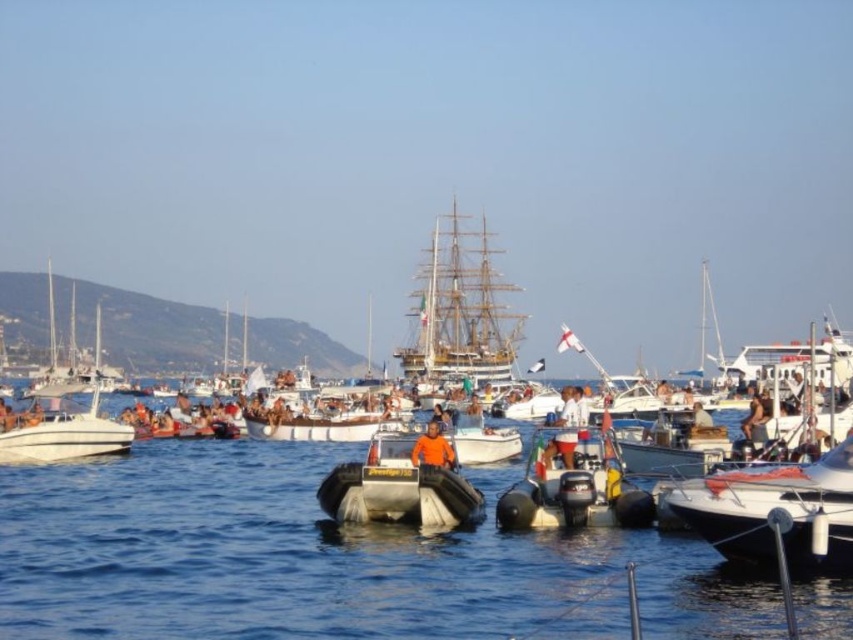
Question: Which point is farther to the camera?

Choices:
 (A) orange fabric person at center
 (B) white matte boat at left

Answer: (B)

Question: Is the position of orange fabric shirt at center less distant than that of orange fabric person at center?

Choices:
 (A) yes
 (B) no

Answer: (B)

Question: Which point appears closest to the camera in this image?

Choices:
 (A) (415, 452)
 (B) (508, 291)
 (C) (71, 458)

Answer: (A)

Question: Does wooden ship at center appear on the left side of orange fabric person at center?

Choices:
 (A) no
 (B) yes

Answer: (A)

Question: Estimate the real-world distances between objects in this image. Which object is closer to the orange fabric shirt at center?

Choices:
 (A) white glossy motorboat at right
 (B) clear blue water at center
 (C) brown leather jacket at center
 (D) silver metallic dinghy at center

Answer: (D)

Question: Can you confirm if silver metallic dinghy at center is thinner than brown leather jacket at center?

Choices:
 (A) yes
 (B) no

Answer: (A)